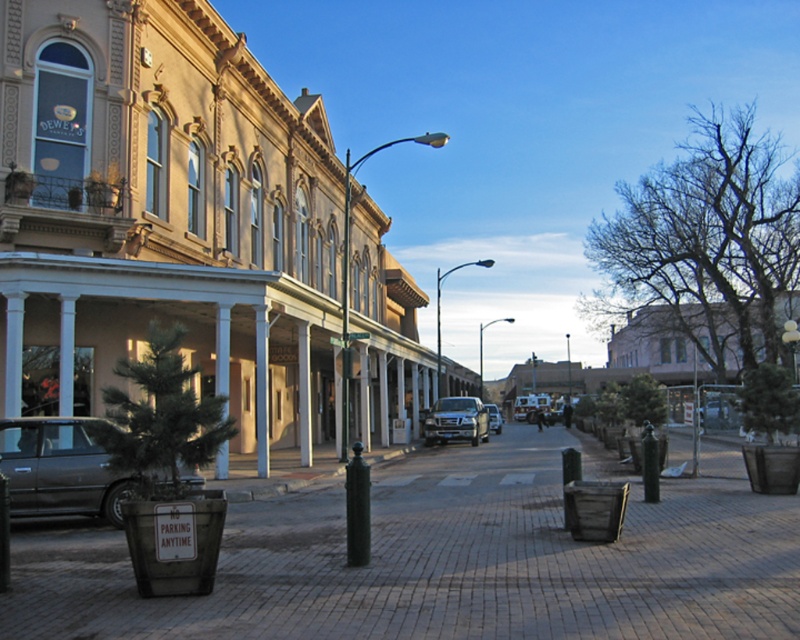
You are a delivery driver who needs to park your metallic silver truck at center in a spot that requires the vehicle to be narrower than the available space. The parking space is located where the brick pavement at center is. Based on the scene, can you safely park your truck there?

The brick pavement at center might be wider than metallic silver truck at center, so there is a possibility that the truck can fit, but it is uncertain. You should check the exact dimensions before deciding to park.

You are a delivery person who needs to park your metallic silver suv at center in a spot that can accommodate its size. The brick pavement at center is the only available parking area. Based on the scene, can your vehicle fit in the parking spot?

The brick pavement at center is bigger than the metallic silver suv at center, so yes, the metallic silver suv at center can fit in the parking spot as the pavement is larger in size.

You are driving a matte black car at left and want to park it under the covered porch near the brushed metal pillar at center. The porch has a height restriction of 6 feet. Can you safely park your car there without hitting the roof?

The matte black car at left is not as tall as the brushed metal pillar at center. Since the pillar is taller than the car, and the porch has a 6 feet height restriction, you can safely park the matte black car at left under the covered porch without hitting the roof.